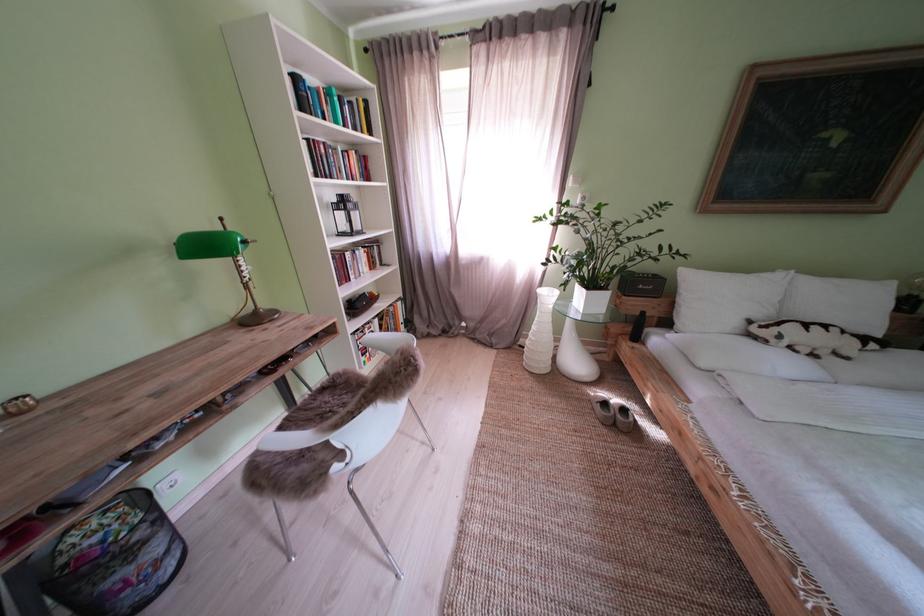
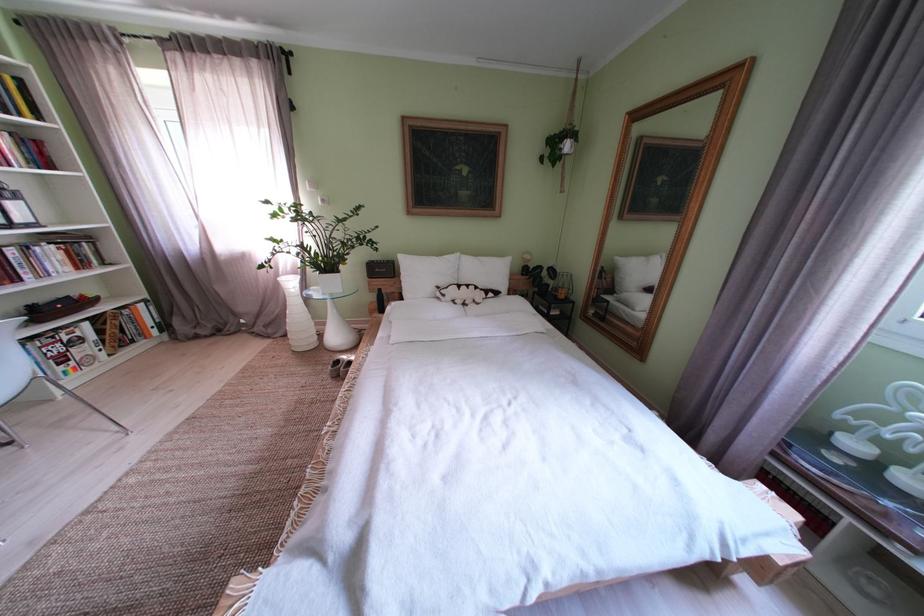
The point at (723, 304) is marked in the first image. Where is the corresponding point in the second image?

(429, 280)